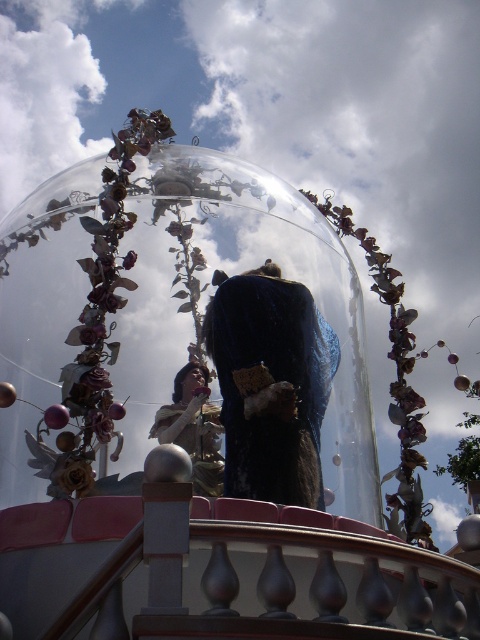
Question: Which of the following is the farthest from the observer?

Choices:
 (A) matte gold dress at center
 (B) velvet-like dark blue coat at center

Answer: (A)

Question: In this image, where is velvet-like dark blue coat at center located relative to matte gold dress at center?

Choices:
 (A) below
 (B) above

Answer: (B)

Question: Is velvet-like dark blue coat at center to the right of matte gold dress at center from the viewer's perspective?

Choices:
 (A) no
 (B) yes

Answer: (B)

Question: Which of the following is the closest to the observer?

Choices:
 (A) (249, 397)
 (B) (194, 396)

Answer: (A)

Question: Among these objects, which one is farthest from the camera?

Choices:
 (A) matte gold dress at center
 (B) velvet-like dark blue coat at center

Answer: (A)

Question: Does velvet-like dark blue coat at center appear on the left side of matte gold dress at center?

Choices:
 (A) yes
 (B) no

Answer: (B)